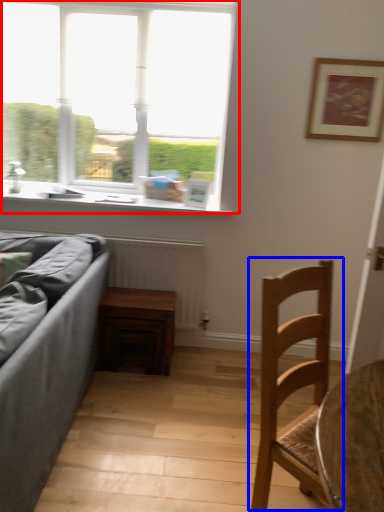
Question: Among these objects, which one is nearest to the camera, window (highlighted by a red box) or chair (highlighted by a blue box)?

Choices:
 (A) window
 (B) chair

Answer: (B)